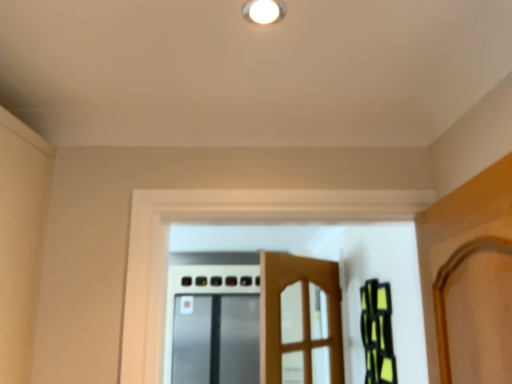
Question: Considering the relative positions of white glossy light fixture at upper center and satin silver screen door at center in the image provided, is white glossy light fixture at upper center to the left or to the right of satin silver screen door at center?

Choices:
 (A) left
 (B) right

Answer: (B)

Question: From a real-world perspective, is white glossy light fixture at upper center positioned above or below satin silver screen door at center?

Choices:
 (A) below
 (B) above

Answer: (B)

Question: Which of these objects is positioned closest to the white glossy light fixture at upper center?

Choices:
 (A) wooden door at center
 (B) satin silver screen door at center

Answer: (A)

Question: Estimate the real-world distances between objects in this image. Which object is closer to the white glossy light fixture at upper center?

Choices:
 (A) wooden door at center
 (B) satin silver screen door at center

Answer: (A)